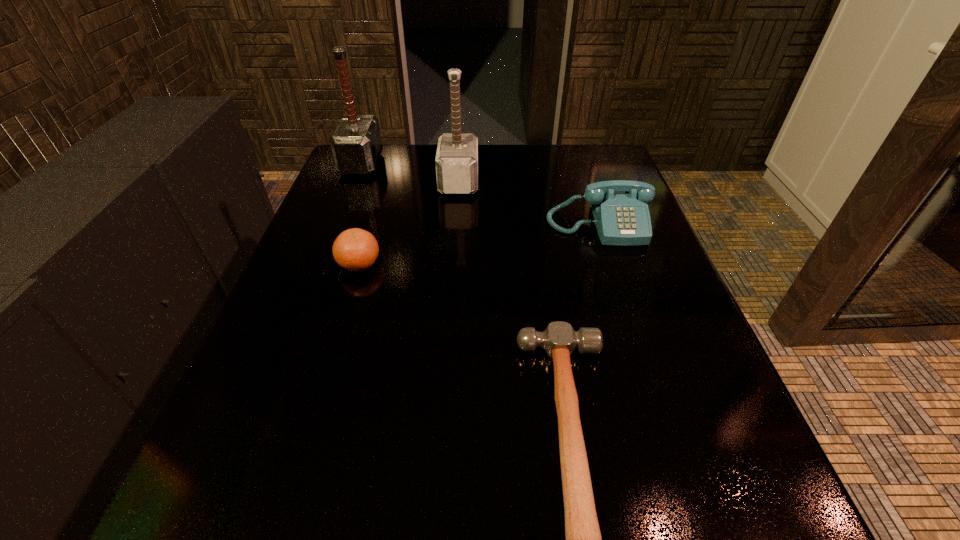
Where is `the leftmost hammer`? Image resolution: width=960 pixels, height=540 pixels. the leftmost hammer is located at coordinates (356, 145).

This screenshot has width=960, height=540. I want to click on the second hammer from right to left, so click(x=456, y=161).

I want to click on the third tallest object, so click(x=620, y=208).

Locate an element on the screen. This screenshot has width=960, height=540. the third nearest object is located at coordinates (620, 208).

This screenshot has height=540, width=960. I want to click on clementine, so click(x=355, y=249).

Find the location of `the fourth tallest object`. the fourth tallest object is located at coordinates (355, 249).

Locate an element on the screen. blank space located 0.230m on the front of the leftmost hammer is located at coordinates (333, 234).

I want to click on blank space located 0.160m for striking with the head of the second hammer from right to left, so click(541, 182).

The image size is (960, 540). Find the location of `free space located 0.100m on the dial of the third farthest object`. free space located 0.100m on the dial of the third farthest object is located at coordinates (617, 280).

I want to click on free space located on the back of the second nearest object, so click(378, 199).